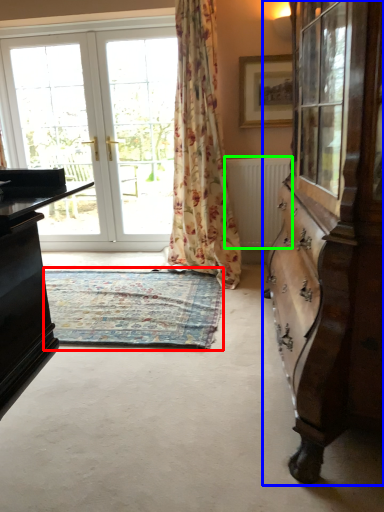
Question: Based on their relative distances, which object is farther from mat (highlighted by a red box)? Choose from cabinetry (highlighted by a blue box) and radiator (highlighted by a green box).

Choices:
 (A) cabinetry
 (B) radiator

Answer: (A)